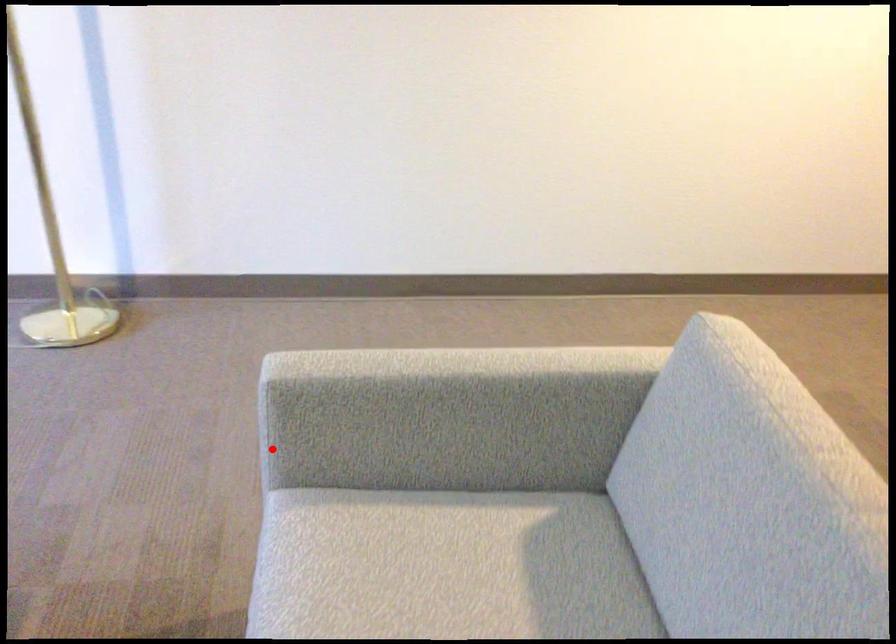
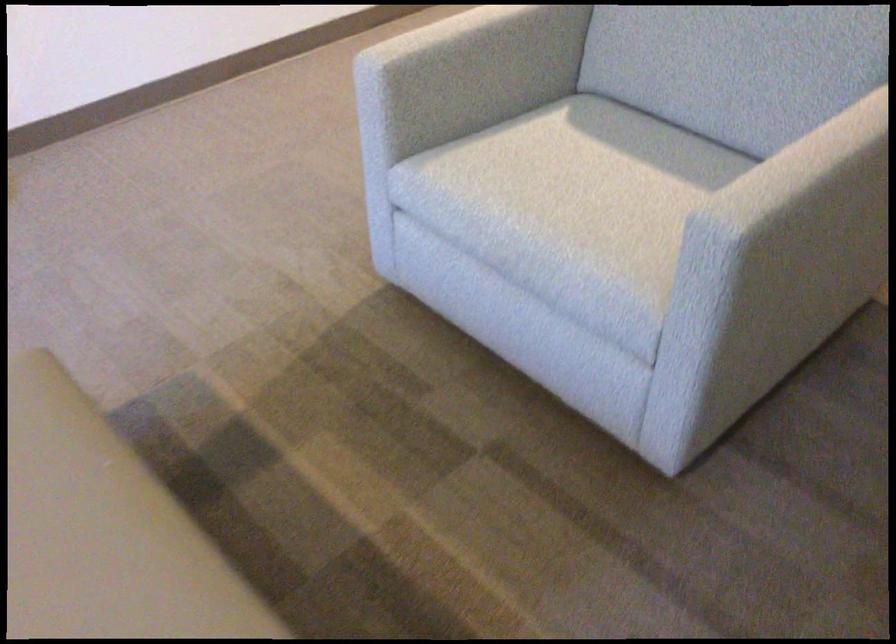
Question: I am providing you with two images of the same scene from different viewpoints. Image1 has a red point marked. In image2, the corresponding 3D location appears at what relative position? Reply with the corresponding letter.

Choices:
 (A) Closer
 (B) Farther

Answer: (B)